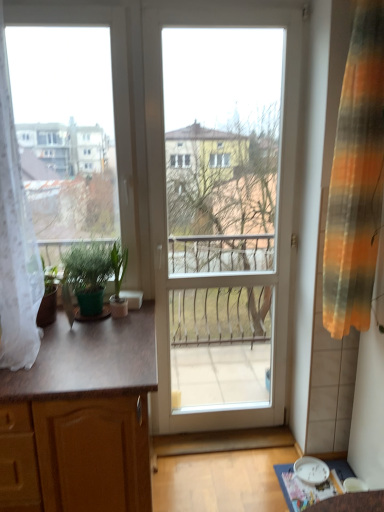
Question: From a real-world perspective, is green matte plant at left, which is the 1th houseplant in left-to-right order, positioned over green matte plant at left, positioned as the second houseplant in left-to-right order, based on gravity?

Choices:
 (A) no
 (B) yes

Answer: (B)

Question: Is green matte plant at left, marked as the 2th houseplant in a right-to-left arrangement, closer to camera compared to green matte plant at left, positioned as the second houseplant in left-to-right order?

Choices:
 (A) no
 (B) yes

Answer: (B)

Question: Is green matte plant at left, marked as the 2th houseplant in a right-to-left arrangement, located outside green matte plant at left, positioned as the second houseplant in left-to-right order?

Choices:
 (A) yes
 (B) no

Answer: (A)

Question: Is green matte plant at left, marked as the 2th houseplant in a right-to-left arrangement, shorter than green matte plant at left, positioned as the second houseplant in left-to-right order?

Choices:
 (A) yes
 (B) no

Answer: (B)

Question: Are green matte plant at left, which is the 1th houseplant in left-to-right order, and green matte plant at left, positioned as the second houseplant in left-to-right order, far apart?

Choices:
 (A) no
 (B) yes

Answer: (A)

Question: Does green matte plant at left, marked as the 2th houseplant in a right-to-left arrangement, have a greater height compared to green matte plant at left, which is the 1th houseplant in right-to-left order?

Choices:
 (A) no
 (B) yes

Answer: (B)

Question: Is white lace curtain at left, acting as the second curtain starting from the right, positioned in front of green matte plant at left, which is the 1th houseplant in left-to-right order?

Choices:
 (A) yes
 (B) no

Answer: (A)

Question: Considering the relative sizes of white lace curtain at left, acting as the second curtain starting from the right, and green matte plant at left, marked as the 2th houseplant in a right-to-left arrangement, in the image provided, is white lace curtain at left, acting as the second curtain starting from the right, taller than green matte plant at left, marked as the 2th houseplant in a right-to-left arrangement,?

Choices:
 (A) no
 (B) yes

Answer: (B)

Question: Considering the relative sizes of white lace curtain at left, which is counted as the 1th curtain, starting from the left, and green matte plant at left, which is the 1th houseplant in left-to-right order, in the image provided, is white lace curtain at left, which is counted as the 1th curtain, starting from the left, shorter than green matte plant at left, which is the 1th houseplant in left-to-right order,?

Choices:
 (A) no
 (B) yes

Answer: (A)

Question: From the image's perspective, is white lace curtain at left, which is counted as the 1th curtain, starting from the left, above green matte plant at left, which is the 1th houseplant in left-to-right order?

Choices:
 (A) yes
 (B) no

Answer: (A)

Question: Can you confirm if white lace curtain at left, which is counted as the 1th curtain, starting from the left, is smaller than green matte plant at left, marked as the 2th houseplant in a right-to-left arrangement?

Choices:
 (A) yes
 (B) no

Answer: (B)

Question: From a real-world perspective, is white lace curtain at left, acting as the second curtain starting from the right, physically above green matte plant at left, which is the 1th houseplant in left-to-right order?

Choices:
 (A) no
 (B) yes

Answer: (B)

Question: Does wooden cabinet at left have a greater width compared to green matte plant at left, positioned as the second houseplant in left-to-right order?

Choices:
 (A) yes
 (B) no

Answer: (A)